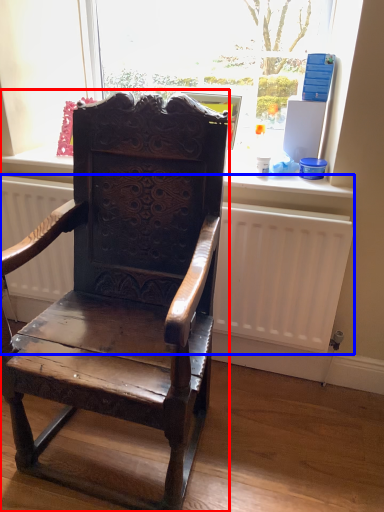
Question: Which of the following is the closest to the observer, chair (highlighted by a red box) or radiator (highlighted by a blue box)?

Choices:
 (A) chair
 (B) radiator

Answer: (A)